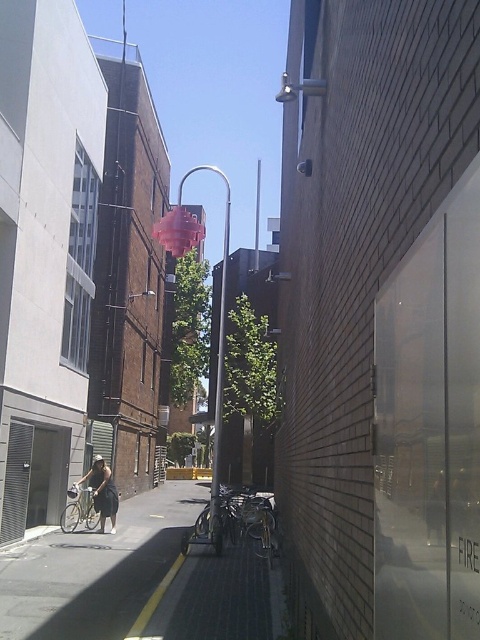
You are a delivery person trying to navigate through the alley. You need to place a large package on the dark gray concrete pavement at center. However, there is a pink translucent lamp post at center above it. Is there enough vertical space between them for the package to fit underneath the lamp post?

The dark gray concrete pavement at center is located below the pink translucent lamp post at center, so there is vertical space between them. The package can be placed on the pavement as it is positioned under the lamp post.

You are standing at the entrance of the alley and want to walk straight ahead. Is the path clear of any obstacles between your current position and the point at coordinates (96, 570)?

The path between your current position and the point at coordinates (96, 570) is clear since the dark gray concrete pavement at center occupies that area, which is a walkable surface.